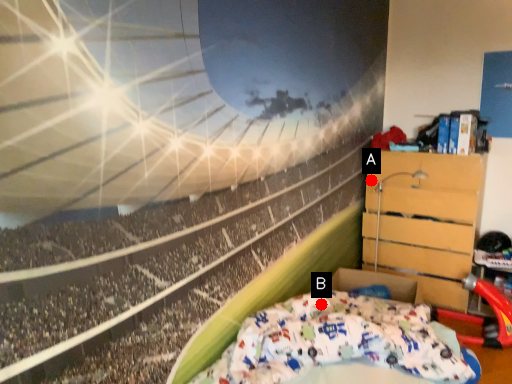
Question: Two points are circled on the image, labeled by A and B beside each circle. Which point is closer to the camera?

Choices:
 (A) A is closer
 (B) B is closer

Answer: (B)